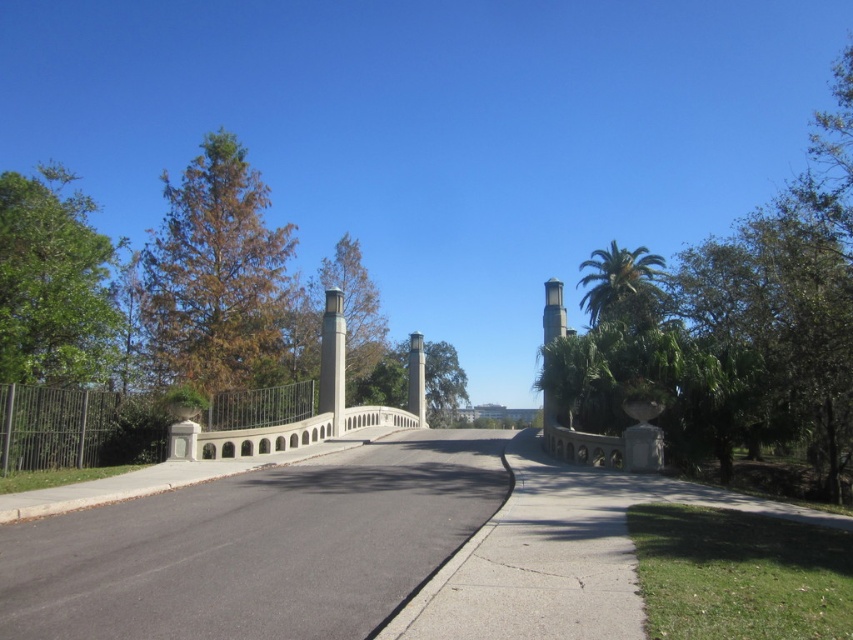
Is point (221, 289) less distant than point (320, 355)?

Yes.

Is brown/dried leaves tree at left to the right of white concrete pillar at center from the viewer's perspective?

Incorrect, brown/dried leaves tree at left is not on the right side of white concrete pillar at center.

Find the location of a particular element. This screenshot has width=853, height=640. brown/dried leaves tree at left is located at coordinates (215, 276).

You are a GUI agent. You are given a task and a screenshot of the screen. Output one action in this format:
    pyautogui.click(x=<x>, y=<y>)
    Task: Click on the brown/dried leaves tree at left
    The image size is (853, 640).
    Given the screenshot: What is the action you would take?
    [215, 276]

Is green leafy tree at right above white stone pillar at center?

Yes, green leafy tree at right is above white stone pillar at center.

Does point (850, 77) come behind point (418, 374)?

No, it is in front of (418, 374).

Between point (585, 419) and point (418, 422), which one is positioned in front?

Point (585, 419) is in front.

Identify the location of green leafy tree at right. Image resolution: width=853 pixels, height=640 pixels. (727, 333).

What do you see at coordinates (727, 333) in the screenshot? The width and height of the screenshot is (853, 640). I see `green leafy tree at right` at bounding box center [727, 333].

Is green leafy tree at right above green leafy palm tree at upper right?

Correct, green leafy tree at right is located above green leafy palm tree at upper right.

Is point (798, 435) closer to viewer compared to point (642, 244)?

Yes, it is.

This screenshot has height=640, width=853. I want to click on green leafy tree at right, so click(x=727, y=333).